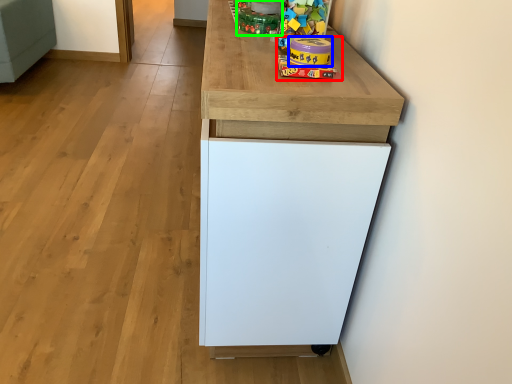
Question: Considering the real-world distances, which object is closest to toy (highlighted by a red box)? toy (highlighted by a blue box) or toy (highlighted by a green box).

Choices:
 (A) toy
 (B) toy

Answer: (A)